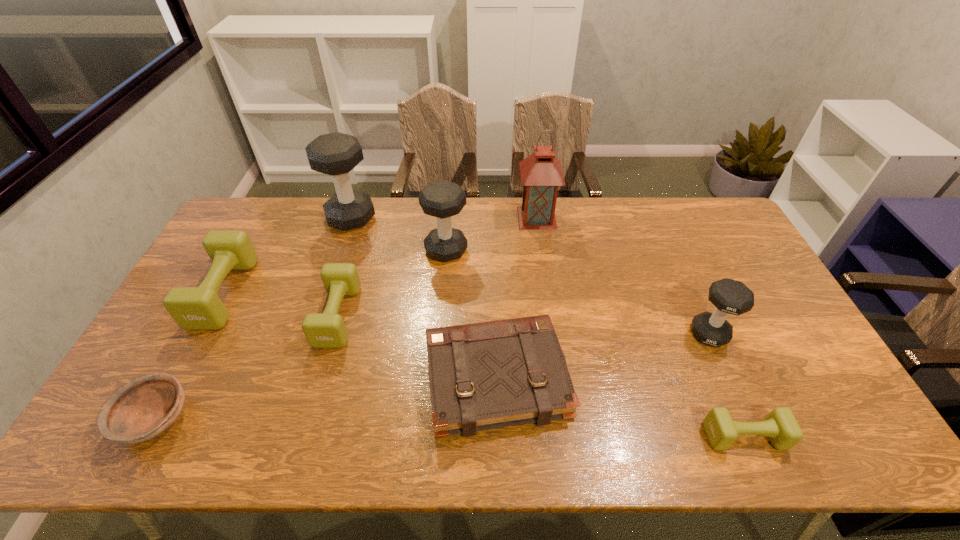
This screenshot has width=960, height=540. What are the coordinates of `object present at the near left corner` in the screenshot? It's located at (142, 409).

I want to click on free space at the far edge of the desktop, so click(x=404, y=230).

This screenshot has height=540, width=960. What are the coordinates of `free space at the near edge of the desktop` in the screenshot? It's located at (296, 451).

What are the coordinates of `free space at the right edge of the desktop` in the screenshot? It's located at (712, 249).

The image size is (960, 540). Find the location of `vacant space at the far left corner of the desktop`. vacant space at the far left corner of the desktop is located at coordinates (248, 225).

Identify the location of free space between the smallest gray dumbbell and the eighth shortest object. (530, 275).

The height and width of the screenshot is (540, 960). I want to click on empty location between the third tallest object and the leftmost gray dumbbell, so click(398, 234).

This screenshot has width=960, height=540. Find the location of `free space between the hardback book and the leftmost dumbbell`. free space between the hardback book and the leftmost dumbbell is located at coordinates (360, 335).

I want to click on empty space between the hardback book and the rightmost olive dumbbell, so click(620, 407).

At what (x,y) coordinates should I click in order to perform the action: click on unoccupied area between the second smallest gray dumbbell and the hardback book. Please return your answer as a coordinate pair (x, y). Looking at the image, I should click on (471, 314).